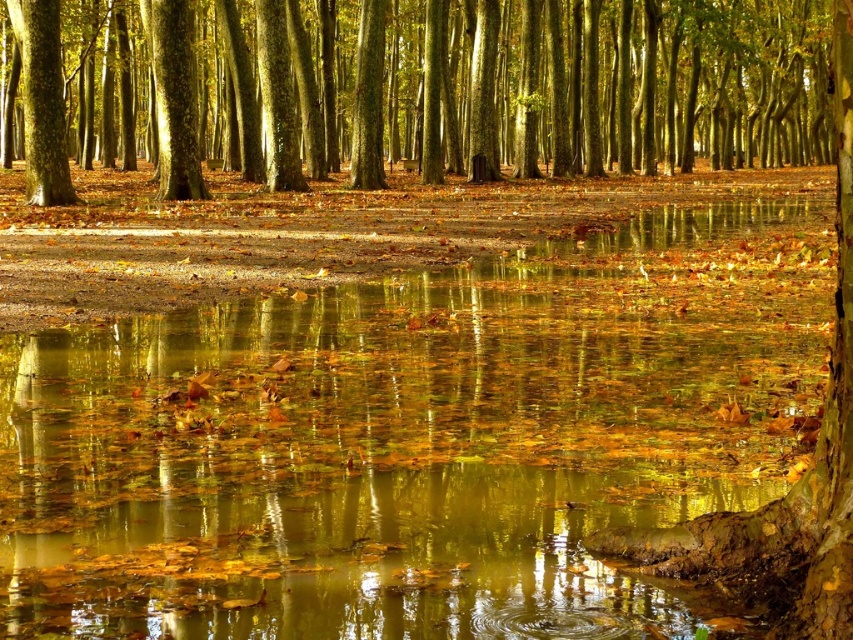
Question: Is translucent golden leaves at center behind smooth bark tree at left?

Choices:
 (A) yes
 (B) no

Answer: (B)

Question: Does translucent golden leaves at center appear under smooth brown tree trunk at upper left?

Choices:
 (A) no
 (B) yes

Answer: (B)

Question: Estimate the real-world distances between objects in this image. Which object is farther from the smooth bark tree at left?

Choices:
 (A) translucent golden leaves at center
 (B) smooth bark tree at center

Answer: (B)

Question: Is smooth bark tree at left above smooth brown tree trunk at upper left?

Choices:
 (A) no
 (B) yes

Answer: (A)

Question: Which of the following is the closest to the observer?

Choices:
 (A) smooth bark tree at left
 (B) smooth bark tree at center
 (C) translucent golden leaves at center

Answer: (B)

Question: Among these objects, which one is nearest to the camera?

Choices:
 (A) translucent golden leaves at center
 (B) smooth brown tree trunk at upper left

Answer: (A)